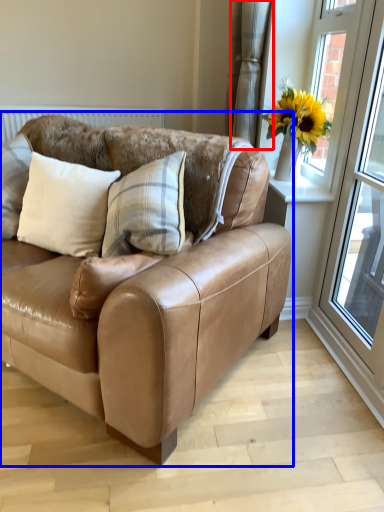
Question: Which object appears farthest to the camera in this image, curtain (highlighted by a red box) or studio couch (highlighted by a blue box)?

Choices:
 (A) curtain
 (B) studio couch

Answer: (A)